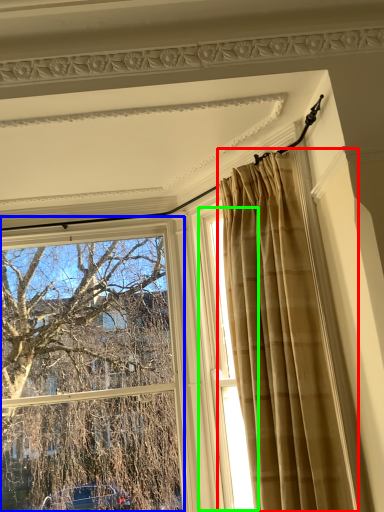
Question: Considering the real-world distances, which object is farthest from curtain (highlighted by a red box)? window (highlighted by a blue box) or window (highlighted by a green box)?

Choices:
 (A) window
 (B) window

Answer: (A)